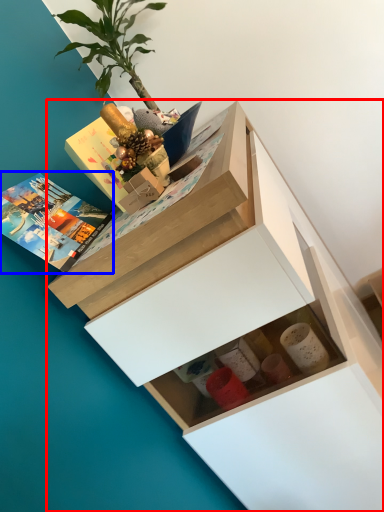
Question: Which object is closer to the camera taking this photo, chest of drawers (highlighted by a red box) or book (highlighted by a blue box)?

Choices:
 (A) chest of drawers
 (B) book

Answer: (A)